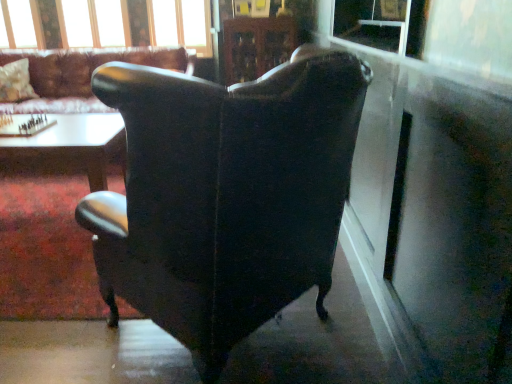
What is the approximate width of fluffy white pillow at upper left?

34.69 centimeters.

Describe the element at coordinates (181, 24) in the screenshot. I see `clear glass window frame at upper center` at that location.

This screenshot has height=384, width=512. What do you see at coordinates (93, 23) in the screenshot?
I see `clear glass window at upper center, the 2th window viewed from the left` at bounding box center [93, 23].

Describe the element at coordinates (24, 125) in the screenshot. This screenshot has width=512, height=384. I see `wooden chessboard at center` at that location.

This screenshot has width=512, height=384. Find the location of `white glossy table at lower left, which is the 1th table from bottom to top`. white glossy table at lower left, which is the 1th table from bottom to top is located at coordinates (54, 215).

Locate an element on the screen. fluffy white pillow at upper left is located at coordinates (16, 82).

In the image, there is a wooden chessboard at center. Where is `chair above it (from the image's perspective)`? chair above it (from the image's perspective) is located at coordinates (82, 75).

From the image's perspective, is wooden chessboard at center below matte black wingback chair at center, which is the first chair from top to bottom?

Yes, from the image's perspective, wooden chessboard at center is below matte black wingback chair at center, which is the first chair from top to bottom.

Relative to matte black wingback chair at center, which is the second chair in right-to-left order, is wooden chessboard at center in front or behind?

wooden chessboard at center is in front of matte black wingback chair at center, which is the second chair in right-to-left order.

From a real-world perspective, is wooden chessboard at center below matte black wingback chair at center, placed as the second chair when sorted from front to back?

Yes.

Is clear glass window at upper center, the 2th window viewed from the left, behind clear glass window frame at upper center?

No.

From a real-world perspective, who is located higher, clear glass window at upper center, the 2th window viewed from the left, or clear glass window frame at upper center?

clear glass window at upper center, the 2th window viewed from the left.

Is clear glass window at upper center, the 2th window viewed from the left, inside the boundaries of clear glass window frame at upper center, or outside?

clear glass window at upper center, the 2th window viewed from the left, is located beyond the bounds of clear glass window frame at upper center.

Looking at this image, in terms of height, does wooden glossy table at center, which is the 1th table from top to bottom, look taller or shorter compared to white glossy table at lower left, placed as the second table when sorted from top to bottom?

Considering their sizes, wooden glossy table at center, which is the 1th table from top to bottom, has more height than white glossy table at lower left, placed as the second table when sorted from top to bottom.

This screenshot has width=512, height=384. Find the location of `table below the wooden glossy table at center, which is the second table from bottom to top (from the image's perspective)`. table below the wooden glossy table at center, which is the second table from bottom to top (from the image's perspective) is located at coordinates (54, 215).

Does wooden glossy table at center, which is the second table from bottom to top, have a greater width compared to white glossy table at lower left, placed as the second table when sorted from top to bottom?

No.

Between clear glass window frame at upper center and wooden chessboard at center, which one has smaller size?

wooden chessboard at center is smaller.

From the picture: Between clear glass window frame at upper center and wooden chessboard at center, which one has more height?

clear glass window frame at upper center is taller.

From a real-world perspective, is clear glass window frame at upper center positioned above or below wooden chessboard at center?

clear glass window frame at upper center is above wooden chessboard at center.

Where is `window frame on the right of wooden chessboard at center`? window frame on the right of wooden chessboard at center is located at coordinates (181, 24).

From a real-world perspective, does transparent glass window at upper center, the 1th window positioned from the left, sit lower than matte black wingback chair at center, the first chair ordered from the bottom?

No, from a real-world perspective, transparent glass window at upper center, the 1th window positioned from the left, is not below matte black wingback chair at center, the first chair ordered from the bottom.

From the picture: Is transparent glass window at upper center, the 2th window from the right, oriented away from matte black wingback chair at center, which appears as the first chair when viewed from the right?

No, transparent glass window at upper center, the 2th window from the right, is not facing away from matte black wingback chair at center, which appears as the first chair when viewed from the right.

Is transparent glass window at upper center, the 2th window from the right, far from matte black wingback chair at center, the 1th chair in the front-to-back sequence?

Absolutely, transparent glass window at upper center, the 2th window from the right, is distant from matte black wingback chair at center, the 1th chair in the front-to-back sequence.

Which of these two, matte black wingback chair at center, the 1th chair from the back, or clear glass window at upper center, the 2th window viewed from the left, is bigger?

Bigger between the two is matte black wingback chair at center, the 1th chair from the back.

Is matte black wingback chair at center, which is the first chair from top to bottom, far away from clear glass window at upper center, the 2th window viewed from the left?

matte black wingback chair at center, which is the first chair from top to bottom, is near clear glass window at upper center, the 2th window viewed from the left, not far away.

From the picture: From a real-world perspective, who is located higher, matte black wingback chair at center, placed as the second chair when sorted from front to back, or clear glass window at upper center, the 2th window viewed from the left?

In real-world perspective, clear glass window at upper center, the 2th window viewed from the left, is above.

From the image's perspective, would you say matte black wingback chair at center, which is the first chair from top to bottom, is shown under clear glass window at upper center, the first window in the right-to-left sequence?

Yes.

Consider the image. Can we say fluffy white pillow at upper left lies outside wooden glossy table at center, which is the 1th table from top to bottom?

Absolutely, fluffy white pillow at upper left is external to wooden glossy table at center, which is the 1th table from top to bottom.

Locate an element on the screen. This screenshot has width=512, height=384. the 1st table below the fluffy white pillow at upper left (from the image's perspective) is located at coordinates (74, 144).

Between fluffy white pillow at upper left and wooden glossy table at center, which is the 1th table from top to bottom, which one has larger size?

wooden glossy table at center, which is the 1th table from top to bottom, is bigger.

In the image, there is a matte black wingback chair at center, which is the first chair from top to bottom. Where is `board game below it (from a real-world perspective)`? The height and width of the screenshot is (384, 512). board game below it (from a real-world perspective) is located at coordinates (24, 125).

There is a clear glass window frame at upper center. Find the location of `the 1st window above it (from a real-world perspective)`. the 1st window above it (from a real-world perspective) is located at coordinates (93, 23).

From the image, which object appears to be farther from transparent plastic window screen at upper right, clear glass window frame at upper center or white glossy table at lower left, which is the 1th table from bottom to top?

clear glass window frame at upper center is positioned further to the anchor transparent plastic window screen at upper right.

Considering their positions, is white glossy table at lower left, placed as the second table when sorted from top to bottom, positioned closer to clear glass window at upper center, the 2th window viewed from the left, than matte black wingback chair at center, placed as the second chair when sorted from front to back?

Based on the image, matte black wingback chair at center, placed as the second chair when sorted from front to back, appears to be nearer to clear glass window at upper center, the 2th window viewed from the left.

Based on their spatial positions, is wooden chessboard at center or white glossy table at lower left, which is the 1th table from bottom to top, further from wooden glossy table at center, which is the second table from bottom to top?

wooden chessboard at center is further to wooden glossy table at center, which is the second table from bottom to top.

Estimate the real-world distances between objects in this image. Which object is closer to transparent glass window at upper center, the 1th window positioned from the left, wooden glossy table at center, which is the second table from bottom to top, or transparent plastic window screen at upper right?

The object closer to transparent glass window at upper center, the 1th window positioned from the left, is wooden glossy table at center, which is the second table from bottom to top.

When comparing their distances from wooden chessboard at center, does clear glass window at upper center, the first window in the right-to-left sequence, or fluffy white pillow at upper left seem further?

clear glass window at upper center, the first window in the right-to-left sequence.

Which object lies nearer to the anchor point transparent plastic window screen at upper right, transparent glass window at upper center, the 1th window positioned from the left, or white glossy table at lower left, which is the 1th table from bottom to top?

Among the two, white glossy table at lower left, which is the 1th table from bottom to top, is located nearer to transparent plastic window screen at upper right.

Estimate the real-world distances between objects in this image. Which object is further from wooden chessboard at center, wooden glossy table at center, which is the 1th table from top to bottom, or fluffy white pillow at upper left?

fluffy white pillow at upper left.

Based on the photo, when comparing their distances from white glossy table at lower left, placed as the second table when sorted from top to bottom, does wooden glossy table at center, which is the second table from bottom to top, or matte black wingback chair at center, the first chair ordered from the bottom, seem further?

matte black wingback chair at center, the first chair ordered from the bottom.

The width and height of the screenshot is (512, 384). What are the coordinates of `window screen between matte black wingback chair at center, the first chair ordered from the bottom, and clear glass window at upper center, the first window in the right-to-left sequence, from front to back` in the screenshot? It's located at (373, 23).

Locate an element on the screen. The image size is (512, 384). board game situated between matte black wingback chair at center, the 1th chair from the back, and transparent plastic window screen at upper right from left to right is located at coordinates (24, 125).

At what (x,y) coordinates should I click in order to perform the action: click on pillow between white glossy table at lower left, which is the 1th table from bottom to top, and clear glass window frame at upper center from front to back. Please return your answer as a coordinate pair (x, y). The image size is (512, 384). Looking at the image, I should click on (16, 82).

Identify the location of chair between wooden glossy table at center, which is the second table from bottom to top, and clear glass window frame at upper center in the front-back direction. Image resolution: width=512 pixels, height=384 pixels. (82, 75).